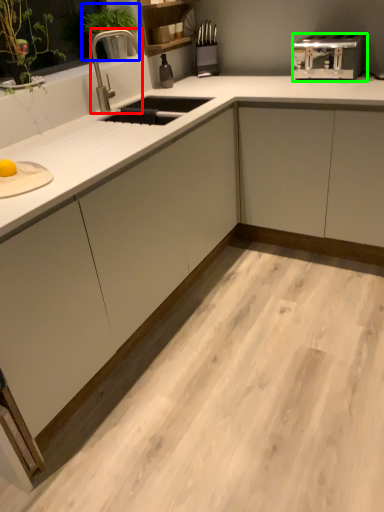
Question: Based on their relative distances, which object is farther from faucet (highlighted by a red box)? Choose from plant (highlighted by a blue box) and toaster (highlighted by a green box).

Choices:
 (A) plant
 (B) toaster

Answer: (B)